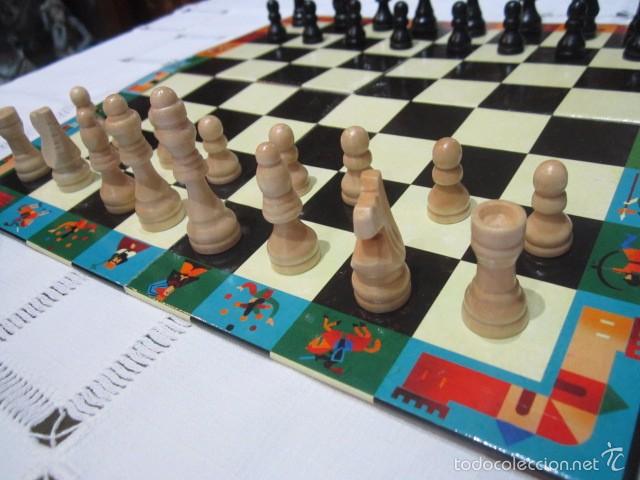
Locate an element on the screen. The width and height of the screenshot is (640, 480). decorative border is located at coordinates (317, 342).